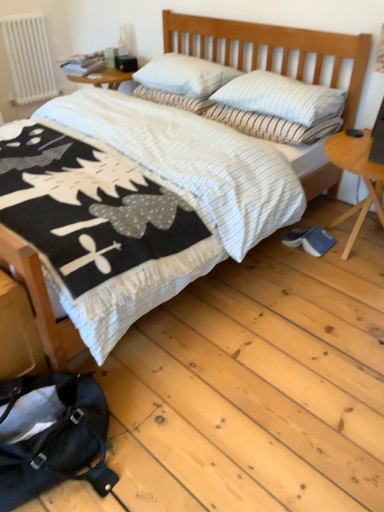
Question: From a real-world perspective, is white striped pillow at center, the third pillow positioned from the bottom, positioned under white striped pillow at center, placed as the fourth pillow when sorted from bottom to top, based on gravity?

Choices:
 (A) yes
 (B) no

Answer: (A)

Question: Considering the relative positions of white striped pillow at center, the third pillow positioned from the bottom, and white striped pillow at center, placed as the fourth pillow when sorted from bottom to top, in the image provided, is white striped pillow at center, the third pillow positioned from the bottom, to the left of white striped pillow at center, placed as the fourth pillow when sorted from bottom to top, from the viewer's perspective?

Choices:
 (A) no
 (B) yes

Answer: (B)

Question: Is white striped pillow at center, acting as the second pillow starting from the top, behind white striped pillow at center, placed as the fourth pillow when sorted from bottom to top?

Choices:
 (A) no
 (B) yes

Answer: (B)

Question: Can you confirm if white striped pillow at center, acting as the second pillow starting from the top, is taller than white striped pillow at center, marked as the 1th pillow in a top-to-bottom arrangement?

Choices:
 (A) no
 (B) yes

Answer: (A)

Question: Can we say white striped pillow at center, acting as the second pillow starting from the top, lies outside white striped pillow at center, placed as the fourth pillow when sorted from bottom to top?

Choices:
 (A) yes
 (B) no

Answer: (B)

Question: Considering their positions, is white striped pillow at upper center, the fourth pillow from the top, located in front of or behind white painted metal radiator at upper left?

Choices:
 (A) behind
 (B) front

Answer: (B)

Question: Is white striped pillow at upper center, the fourth pillow from the top, to the left or to the right of white painted metal radiator at upper left in the image?

Choices:
 (A) left
 (B) right

Answer: (B)

Question: Which is correct: white striped pillow at upper center, which is the 1th pillow from bottom to top, is inside white painted metal radiator at upper left, or outside of it?

Choices:
 (A) outside
 (B) inside

Answer: (A)

Question: Considering the positions of point (238, 121) and point (39, 90), is point (238, 121) closer or farther from the camera than point (39, 90)?

Choices:
 (A) farther
 (B) closer

Answer: (B)

Question: From their relative heights in the image, would you say white striped pillow at center, marked as the 1th pillow in a top-to-bottom arrangement, is taller or shorter than white striped pillow at upper center, the fourth pillow from the top?

Choices:
 (A) short
 (B) tall

Answer: (B)

Question: Does point (139, 76) appear closer or farther from the camera than point (261, 114)?

Choices:
 (A) farther
 (B) closer

Answer: (A)

Question: From the image's perspective, relative to white striped pillow at upper center, which is the 1th pillow from bottom to top, is white striped pillow at center, marked as the 1th pillow in a top-to-bottom arrangement, above or below?

Choices:
 (A) below
 (B) above

Answer: (B)

Question: Relative to white striped pillow at upper center, the fourth pillow from the top, is white striped pillow at center, marked as the 1th pillow in a top-to-bottom arrangement, in front or behind?

Choices:
 (A) behind
 (B) front

Answer: (A)

Question: From the image's perspective, is white striped pillow at upper center, which is the 1th pillow from bottom to top, located above or below white striped pillow at center, placed as the fourth pillow when sorted from bottom to top?

Choices:
 (A) above
 (B) below

Answer: (B)

Question: Is white striped pillow at upper center, which is the 1th pillow from bottom to top, wider or thinner than white striped pillow at center, marked as the 1th pillow in a top-to-bottom arrangement?

Choices:
 (A) thin
 (B) wide

Answer: (A)